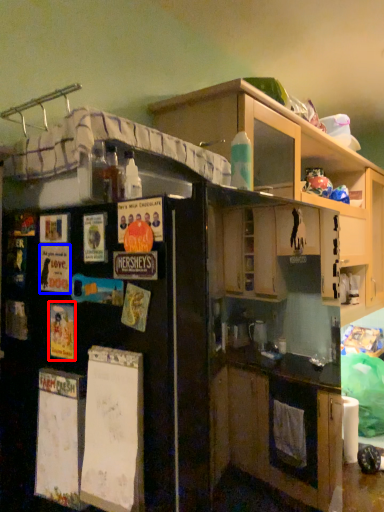
Question: Among these objects, which one is farthest to the camera, poster (highlighted by a red box) or poster (highlighted by a blue box)?

Choices:
 (A) poster
 (B) poster

Answer: (B)